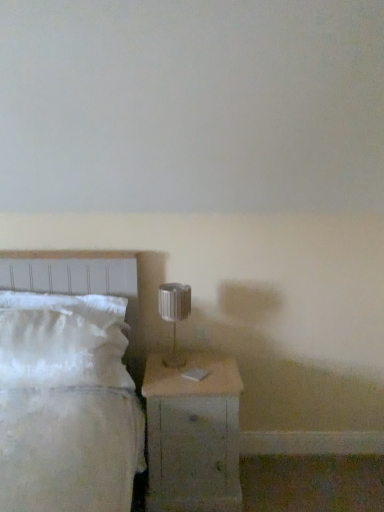
Where is `vacant space underneath metallic silver table lamp at center (from a real-world perspective)`? This screenshot has height=512, width=384. vacant space underneath metallic silver table lamp at center (from a real-world perspective) is located at coordinates (185, 360).